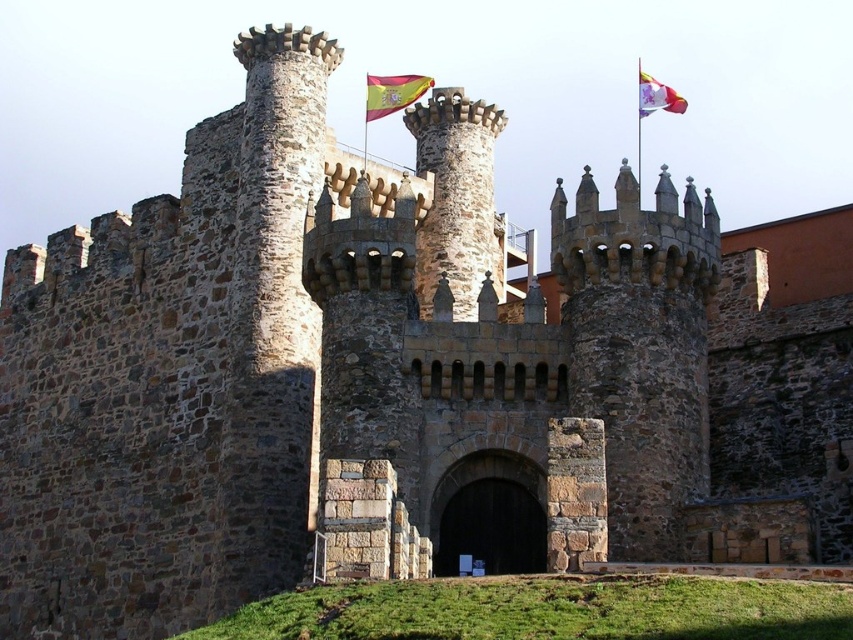
You are a knight standing at the entrance of the castle and want to know which flag is shorter between the red fabric flag at upper center and the white fabric flag at upper right. Can you tell me?

The red fabric flag at upper center is not as tall as the white fabric flag at upper right, so the red fabric flag at upper center is shorter.

You are standing in front of the medieval castle and notice two points marked on the castle walls. The first point is at coordinate point (448, 532) and the second is at point (642, 80). If you want to touch both points starting from the nearest one, which point should you touch first?

You should touch point (448, 532) first because it is closer to you than point (642, 80).

You are a visitor approaching the castle and see the brown wooden gate at center and the white fabric flag at upper right. Which object is located to the left of the other?

The brown wooden gate at center is positioned on the left side of white fabric flag at upper right.